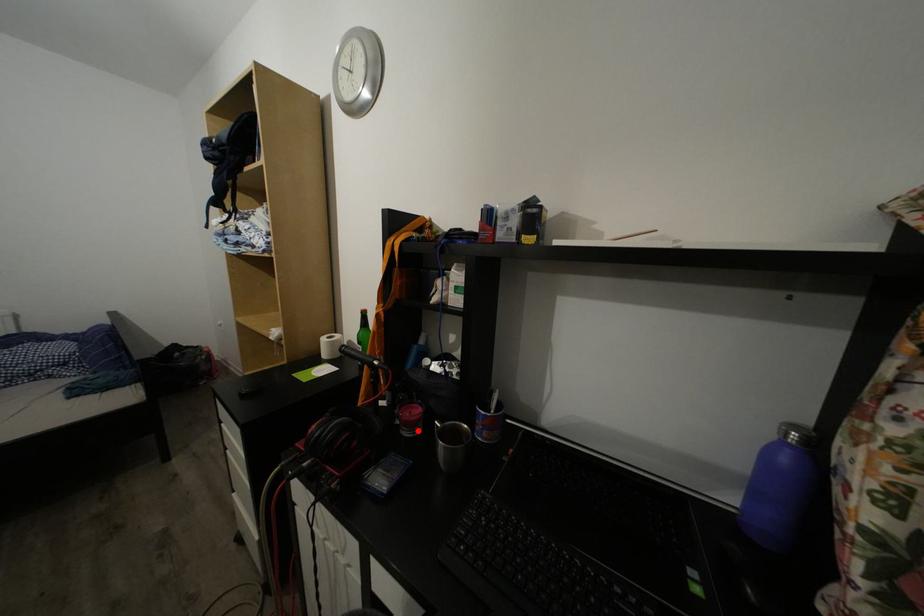
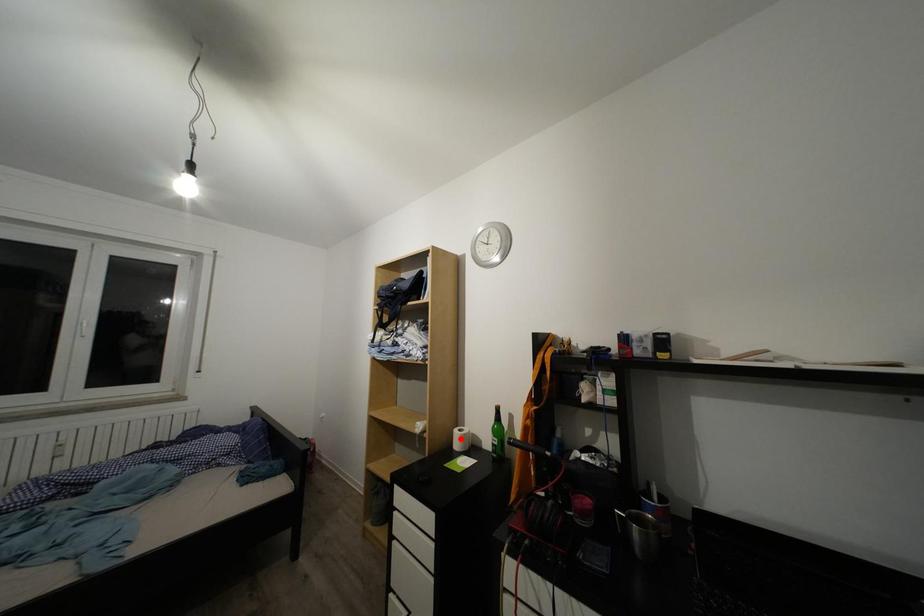
I am providing you with two images of the same scene from different viewpoints. A red point is marked on the first image and another point is marked on the second image. Do the highlighted points in image1 and image2 indicate the same real-world spot?

No